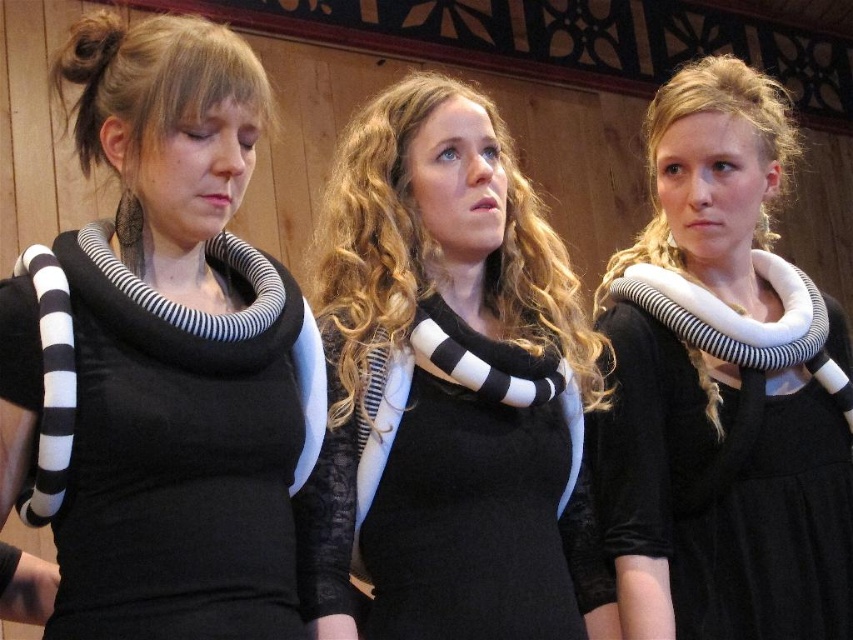
Based on the photo, between black matte scarf at left and white matte neckpiece at center, which one has more height?

white matte neckpiece at center

From the picture: Which of these two, black matte scarf at left or white matte neckpiece at center, stands shorter?

With less height is black matte scarf at left.

Who is more distant from viewer, (262, 80) or (647, 500)?

The point (647, 500) is more distant.

At what (x,y) coordinates should I click in order to perform the action: click on black matte scarf at left. Please return your answer as a coordinate pair (x, y). This screenshot has width=853, height=640. Looking at the image, I should click on pos(161,356).

Can you confirm if black and white striped scarf at center is thinner than white matte neckpiece at center?

No.

Can you confirm if black and white striped scarf at center is positioned to the right of white matte neckpiece at center?

No, black and white striped scarf at center is not to the right of white matte neckpiece at center.

In order to click on black and white striped scarf at center in this screenshot , I will do `click(448, 388)`.

Identify the location of black and white striped scarf at center. (448, 388).

Is point (235, 148) in front of point (577, 401)?

Yes, it is.

Does black matte scarf at left have a smaller size compared to black and white striped scarf at center?

Indeed, black matte scarf at left has a smaller size compared to black and white striped scarf at center.

What do you see at coordinates (161, 356) in the screenshot? I see `black matte scarf at left` at bounding box center [161, 356].

You are a GUI agent. You are given a task and a screenshot of the screen. Output one action in this format:
    pyautogui.click(x=<x>, y=<y>)
    Task: Click on the black matte scarf at left
    The width and height of the screenshot is (853, 640).
    Given the screenshot: What is the action you would take?
    pyautogui.click(x=161, y=356)